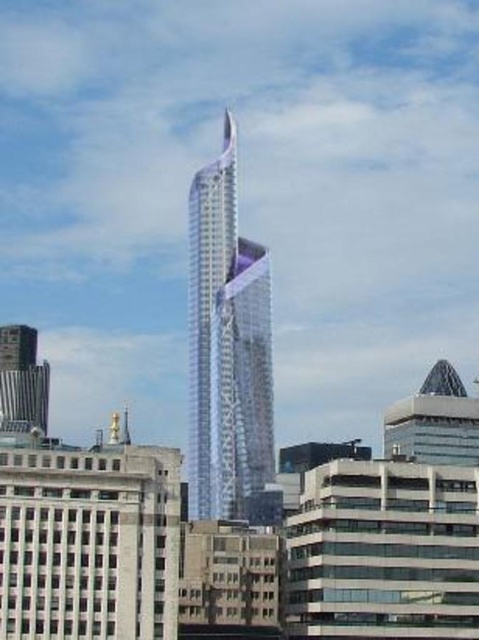
Question: Among these points, which one is farthest from the camera?

Choices:
 (A) (45, 376)
 (B) (244, 416)

Answer: (B)

Question: Does sleek glass tower at center appear on the right side of metallic silver tower at lower left?

Choices:
 (A) no
 (B) yes

Answer: (B)

Question: Which point is farther from the camera taking this photo?

Choices:
 (A) coord(35,390)
 (B) coord(230,449)

Answer: (B)

Question: Does sleek glass tower at center come behind metallic silver tower at lower left?

Choices:
 (A) yes
 (B) no

Answer: (A)

Question: Is sleek glass tower at center to the right of metallic silver tower at lower left from the viewer's perspective?

Choices:
 (A) no
 (B) yes

Answer: (B)